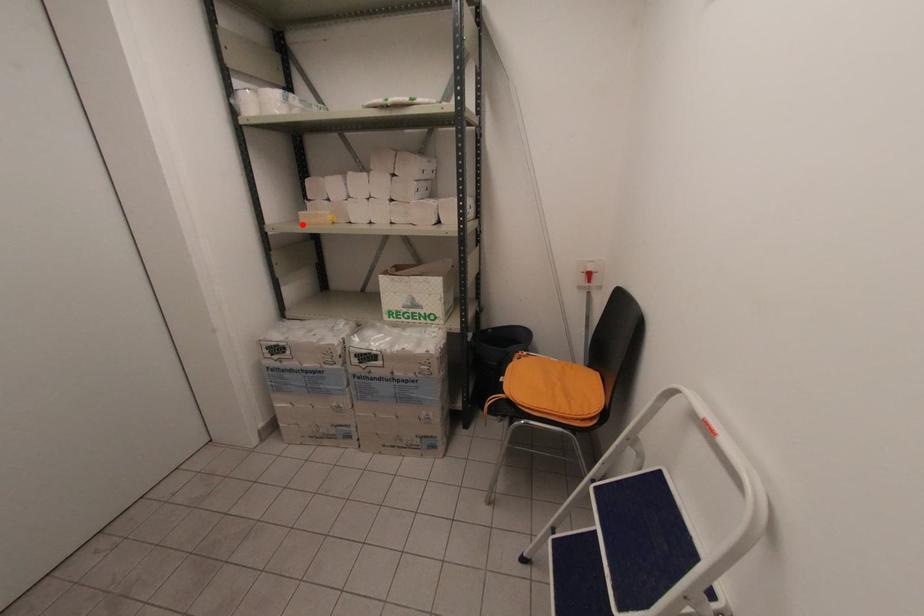
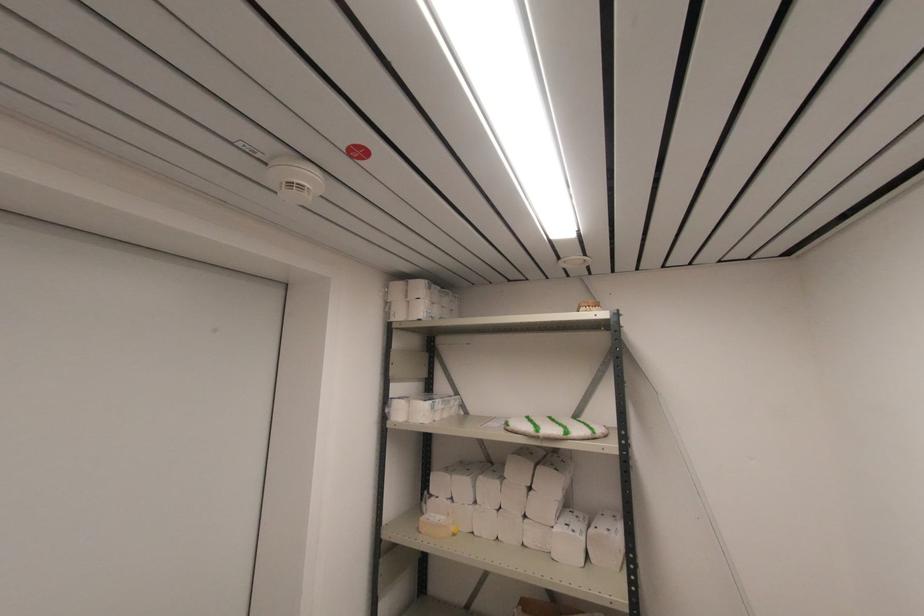
In the second image, find the point that corresponds to the highlighted location in the first image.

(420, 533)